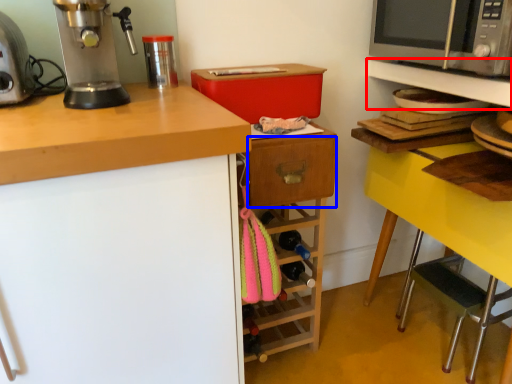
Question: Which point is further to the camera, shelf (highlighted by a red box) or drawer (highlighted by a blue box)?

Choices:
 (A) shelf
 (B) drawer

Answer: (B)